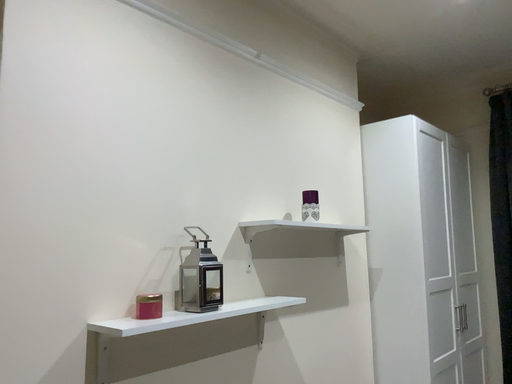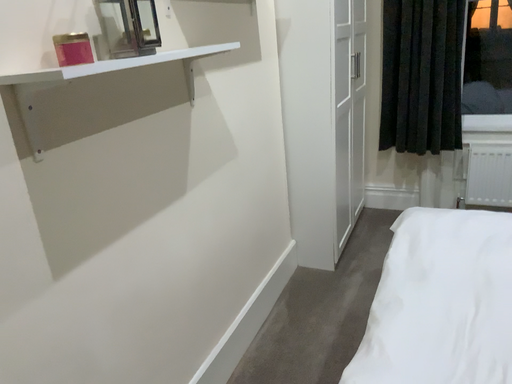
Question: How did the camera likely rotate when shooting the video?

Choices:
 (A) rotated left
 (B) rotated right

Answer: (B)